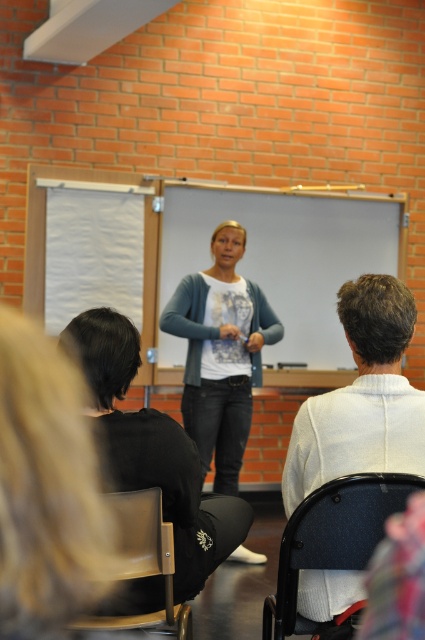
You are a student sitting in the classroom and notice two items in the scene. The first is the white sweater at center, and the second is the black fabric pants at lower left. Which of these two items has a narrower width?

The white sweater at center is thinner than the black fabric pants at lower left, so the white sweater at center has a narrower width.

You are sitting in the classroom and want to know which of the two points, point (380, 289) or point (266, 316), is closer to you. Based on their positions on the whiteboard, which one would you say is nearer?

Point (380, 289) is in front of point (266, 316), so it is closer to you.